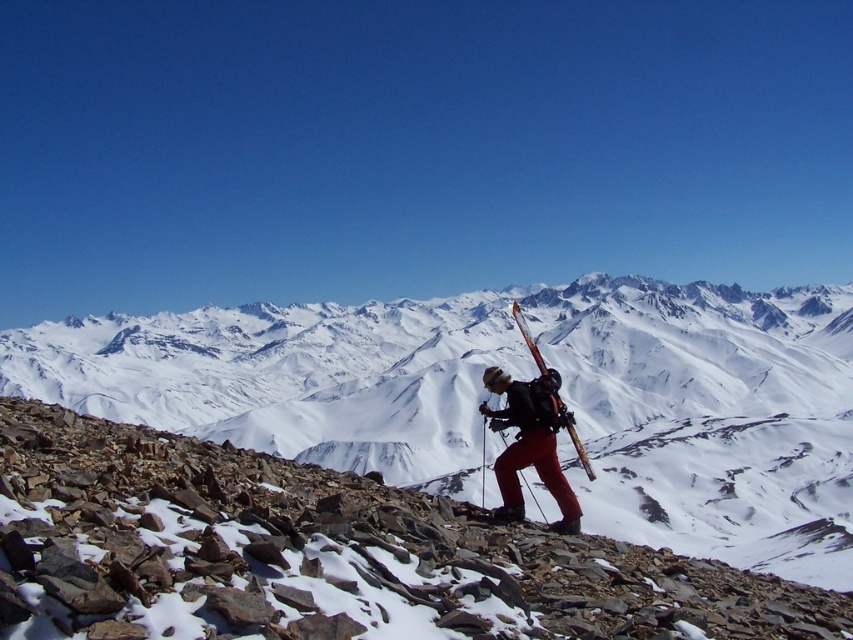
Which is more to the left, matte black backpack at center or matte black ski at center?

matte black backpack at center

Does matte black backpack at center have a lesser width compared to matte black ski at center?

Yes.

Is point (511, 454) more distant than point (560, 412)?

No.

Locate an element on the screen. The width and height of the screenshot is (853, 640). matte black backpack at center is located at coordinates 529,444.

Is snowy rocky mountain at center thinner than matte black ski at center?

No.

Is snowy rocky mountain at center bigger than matte black ski at center?

Indeed, snowy rocky mountain at center has a larger size compared to matte black ski at center.

Find the location of `snowy rocky mountain at center`. snowy rocky mountain at center is located at coordinates (517, 378).

Is snowy rocky mountain at center to the right of matte black backpack at center from the viewer's perspective?

No, snowy rocky mountain at center is not to the right of matte black backpack at center.

Can you confirm if snowy rocky mountain at center is wider than matte black backpack at center?

Indeed, snowy rocky mountain at center has a greater width compared to matte black backpack at center.

The height and width of the screenshot is (640, 853). I want to click on snowy rocky mountain at center, so click(x=517, y=378).